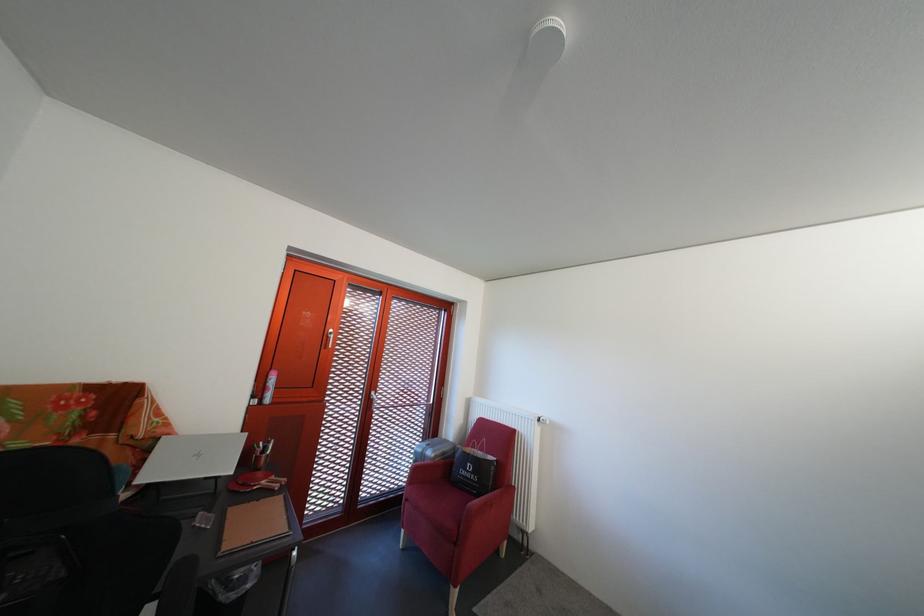
Find the location of a particular element. door handle is located at coordinates (379, 397).